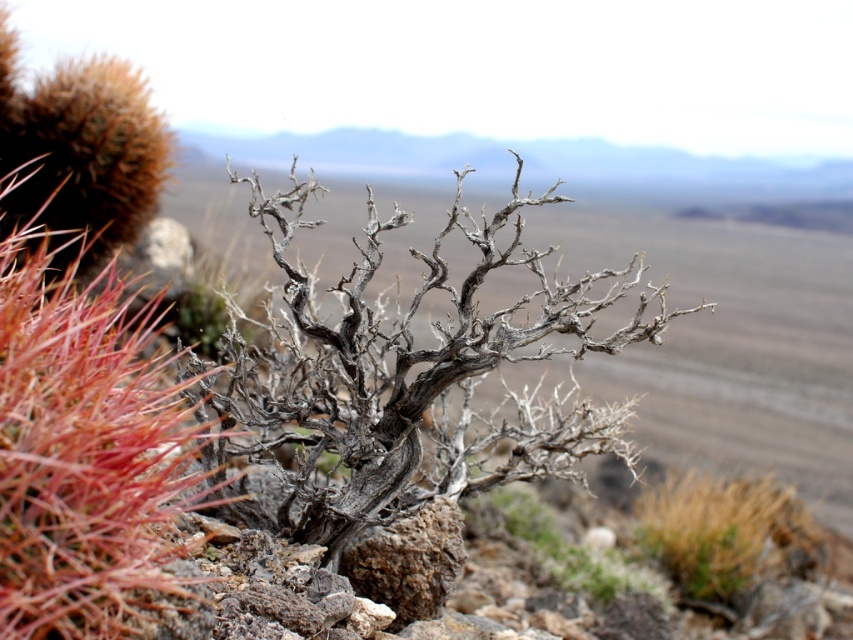
Who is more distant from viewer, (137, 512) or (763, 516)?

Point (763, 516)

Who is positioned more to the left, red spiky cactus at left or brown textured grass at lower right?

red spiky cactus at left

Which is behind, point (18, 516) or point (688, 592)?

The point (688, 592) is behind.

Image resolution: width=853 pixels, height=640 pixels. I want to click on red spiky cactus at left, so click(x=88, y=454).

Can you confirm if gray/dry wood tree at center is thinner than dry wood at center?

Incorrect, gray/dry wood tree at center's width is not less than dry wood at center's.

Identify the location of gray/dry wood tree at center. This screenshot has width=853, height=640. (403, 378).

Locate an element on the screen. This screenshot has width=853, height=640. gray/dry wood tree at center is located at coordinates (403, 378).

Is brown textured grass at lower right smaller than dry wood at center?

No.

Does brown textured grass at lower right have a greater width compared to dry wood at center?

Yes.

Measure the distance between point (698, 588) and camera.

16.02 feet

What are the coordinates of `brown textured grass at lower right` in the screenshot? It's located at (726, 532).